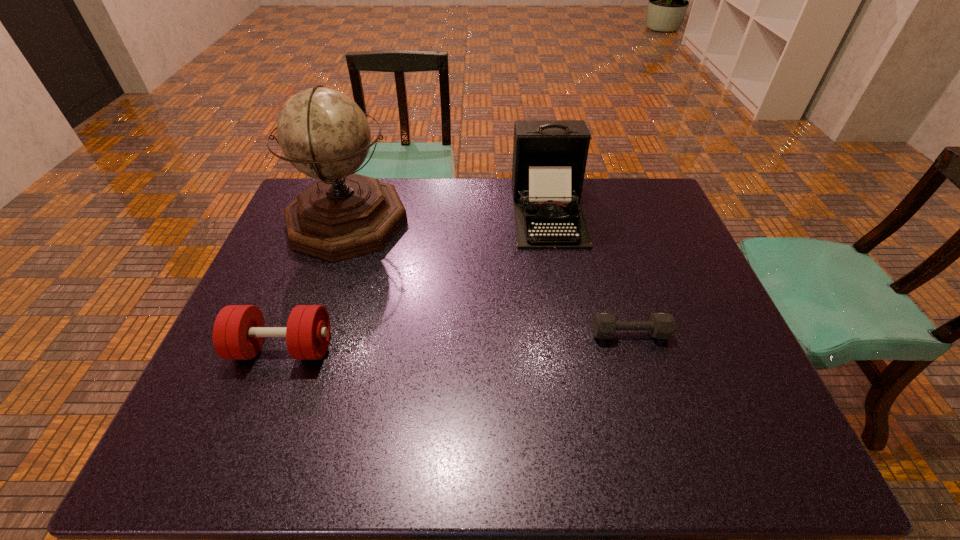
Find the location of `empty location between the tallest object and the second tallest object`. empty location between the tallest object and the second tallest object is located at coordinates click(x=448, y=217).

Identify the location of free space that is in between the shorter dumbbell and the second shortest object. The width and height of the screenshot is (960, 540). (456, 341).

The width and height of the screenshot is (960, 540). What are the coordinates of `free space between the third shortest object and the third tallest object` in the screenshot? It's located at (416, 280).

Locate an element on the screen. The height and width of the screenshot is (540, 960). free area in between the right dumbbell and the third tallest object is located at coordinates (456, 341).

I want to click on vacant area between the typewriter and the tallest object, so click(448, 217).

Find the location of a particular element. The image size is (960, 540). vacant point located between the third shortest object and the right dumbbell is located at coordinates click(x=588, y=273).

Where is `vacant space that is in between the taller dumbbell and the globe`? This screenshot has height=540, width=960. vacant space that is in between the taller dumbbell and the globe is located at coordinates (316, 285).

I want to click on vacant area that lies between the third tallest object and the globe, so click(x=316, y=285).

Image resolution: width=960 pixels, height=540 pixels. I want to click on vacant point located between the globe and the taller dumbbell, so click(x=316, y=285).

Identify the location of vacant region between the shorter dumbbell and the globe. Image resolution: width=960 pixels, height=540 pixels. (489, 278).